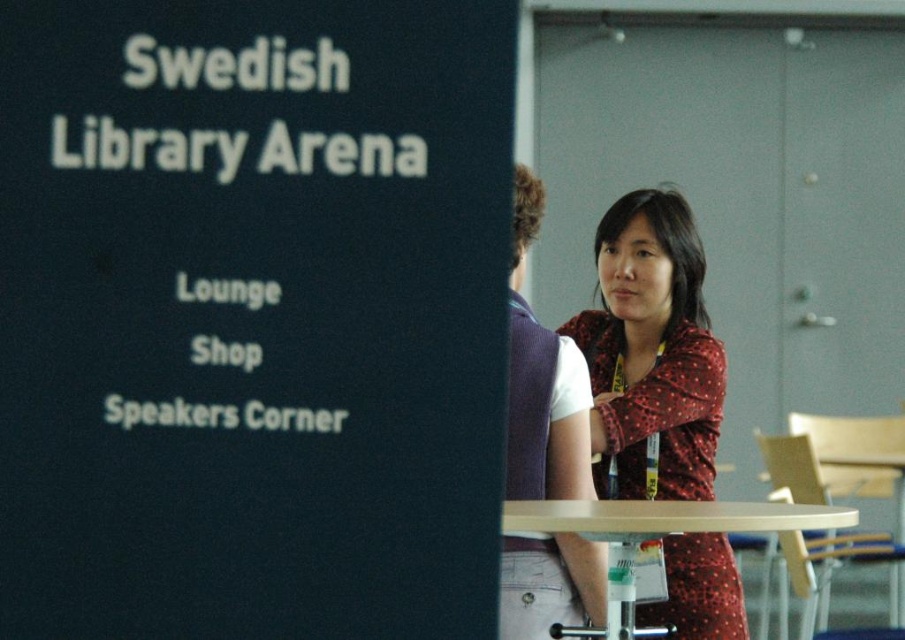
Which of these two, black matte signboard at upper left or matte red dress at center, stands shorter?

Standing shorter between the two is black matte signboard at upper left.

Is point (195, 36) positioned before point (580, 570)?

Yes.

This screenshot has width=905, height=640. Find the location of `black matte signboard at upper left`. black matte signboard at upper left is located at coordinates (252, 323).

Identify the location of black matte signboard at upper left. The width and height of the screenshot is (905, 640). (252, 323).

Who is positioned more to the left, black matte signboard at upper left or polka dot fabric shirt at center?

black matte signboard at upper left

Is black matte signboard at upper left smaller than polka dot fabric shirt at center?

Indeed, black matte signboard at upper left has a smaller size compared to polka dot fabric shirt at center.

What are the coordinates of `black matte signboard at upper left` in the screenshot? It's located at (252, 323).

Does polka dot fabric shirt at center appear on the left side of matte red dress at center?

No, polka dot fabric shirt at center is not to the left of matte red dress at center.

This screenshot has width=905, height=640. Describe the element at coordinates (651, 353) in the screenshot. I see `polka dot fabric shirt at center` at that location.

Locate an element on the screen. The image size is (905, 640). polka dot fabric shirt at center is located at coordinates (651, 353).